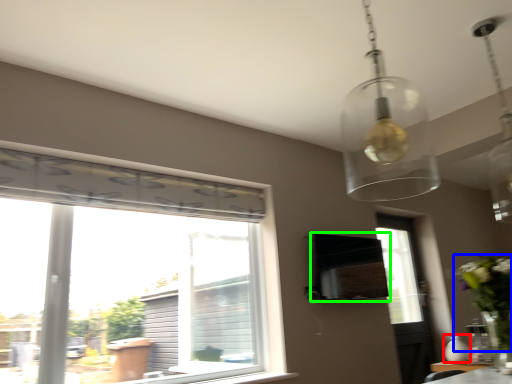
Question: Which is farther away from vase (highlighted by a red box)? floral arrangement (highlighted by a blue box) or vent (highlighted by a green box)?

Choices:
 (A) floral arrangement
 (B) vent

Answer: (B)